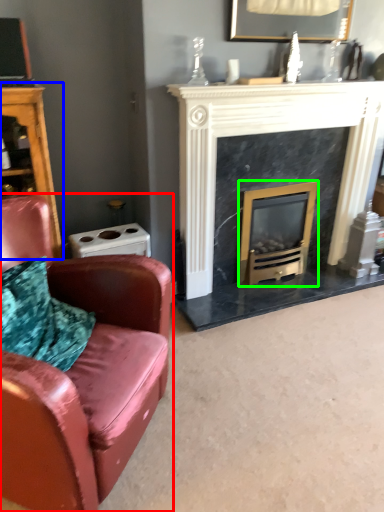
Question: Considering the real-world distances, which object is closest to chair (highlighted by a red box)? dresser (highlighted by a blue box) or wood burning stove (highlighted by a green box).

Choices:
 (A) dresser
 (B) wood burning stove

Answer: (A)